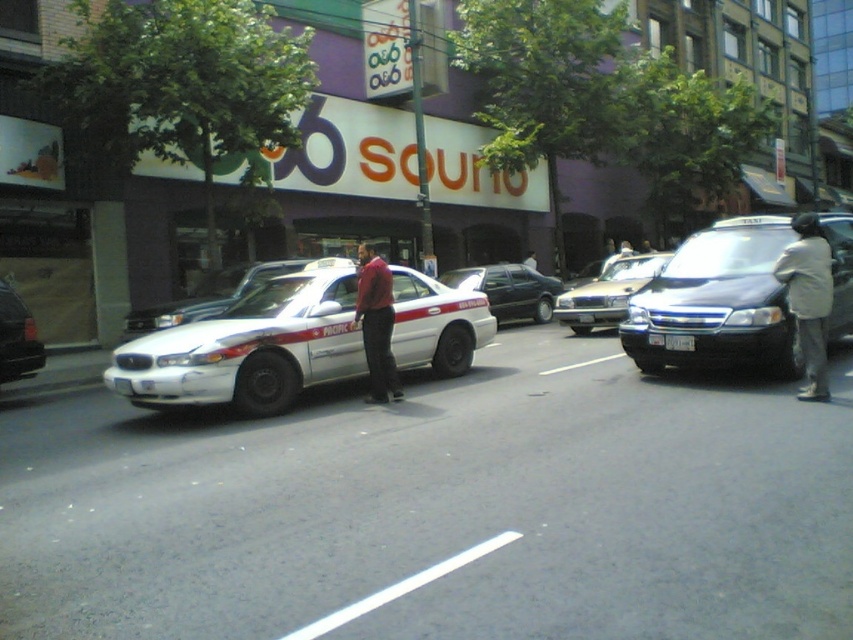
Does shiny black sedan at center right have a lesser height compared to light beige jacket at right?

Correct, shiny black sedan at center right is not as tall as light beige jacket at right.

Is shiny black sedan at center right closer to camera compared to light beige jacket at right?

No, shiny black sedan at center right is further to the viewer.

Measure the distance between point [749,346] and camera.

Point [749,346] and camera are 28.16 feet apart from each other.

Find the location of a particular element. Image resolution: width=853 pixels, height=640 pixels. shiny black sedan at center right is located at coordinates (717, 301).

Who is more distant from viewer, [816,256] or [228,276]?

Positioned behind is point [228,276].

Does light beige jacket at right appear on the right side of white glossy taxi cab at left?

Indeed, light beige jacket at right is positioned on the right side of white glossy taxi cab at left.

Who is more forward, (799, 282) or (218, 305)?

Point (799, 282) is more forward.

Find the location of a particular element. Image resolution: width=853 pixels, height=640 pixels. light beige jacket at right is located at coordinates (808, 298).

Does light beige jacket at right appear over matte red shirt at center?

Correct, light beige jacket at right is located above matte red shirt at center.

Is light beige jacket at right positioned in front of matte red shirt at center?

Yes, it is.

You are a GUI agent. You are given a task and a screenshot of the screen. Output one action in this format:
    pyautogui.click(x=<x>, y=<y>)
    Task: Click on the light beige jacket at right
    The image size is (853, 640).
    Given the screenshot: What is the action you would take?
    pyautogui.click(x=808, y=298)